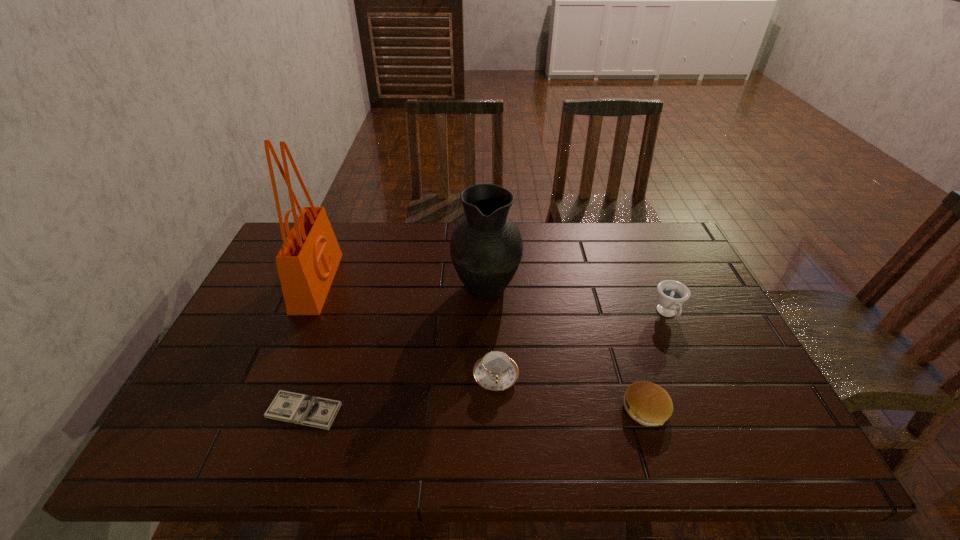
Identify the location of the tallest object. (307, 262).

Locate an element on the screen. pitcher is located at coordinates (486, 247).

In order to click on the third tallest object in this screenshot , I will do `click(671, 296)`.

Where is `the taller teacup`? the taller teacup is located at coordinates click(x=671, y=296).

Where is `the nearer teacup`? This screenshot has height=540, width=960. the nearer teacup is located at coordinates pos(495,371).

Identify the location of the shorter teacup. The image size is (960, 540). (495, 371).

I want to click on patty, so click(647, 403).

Where is `dollar`? dollar is located at coordinates (318, 412).

This screenshot has width=960, height=540. I want to click on blank space located 0.370m on the logo side of the tote bag, so click(x=458, y=282).

The width and height of the screenshot is (960, 540). In order to click on vacant space located on the side of the pitcher with the handle in this screenshot , I will do `click(486, 251)`.